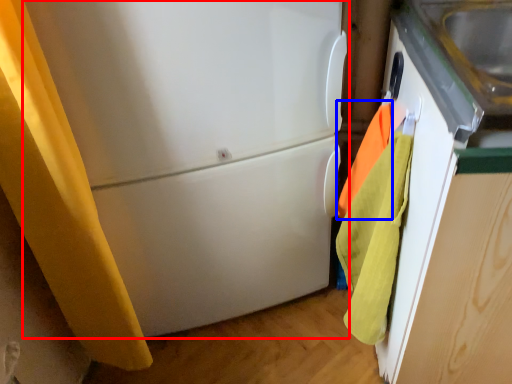
Question: Which of the following is the closest to the observer, refrigerator (highlighted by a red box) or beach towel (highlighted by a blue box)?

Choices:
 (A) refrigerator
 (B) beach towel

Answer: (A)